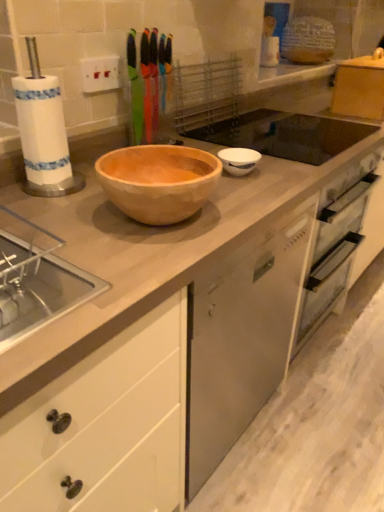
Question: Considering the positions of black glass sink at upper center and white glossy bowl at center in the image, is black glass sink at upper center taller or shorter than white glossy bowl at center?

Choices:
 (A) tall
 (B) short

Answer: (B)

Question: From the image's perspective, is black glass sink at upper center located above or below white glossy bowl at center?

Choices:
 (A) below
 (B) above

Answer: (B)

Question: Is point (235, 136) positioned closer to the camera than point (241, 156)?

Choices:
 (A) closer
 (B) farther

Answer: (B)

Question: Is white glossy bowl at center spatially inside black glass sink at upper center, or outside of it?

Choices:
 (A) outside
 (B) inside

Answer: (A)

Question: From their relative heights in the image, would you say white glossy bowl at center is taller or shorter than black glass sink at upper center?

Choices:
 (A) tall
 (B) short

Answer: (A)

Question: From a real-world perspective, is white glossy bowl at center positioned above or below black glass sink at upper center?

Choices:
 (A) below
 (B) above

Answer: (B)

Question: From the image's perspective, relative to black glass sink at upper center, is white glossy bowl at center above or below?

Choices:
 (A) below
 (B) above

Answer: (A)